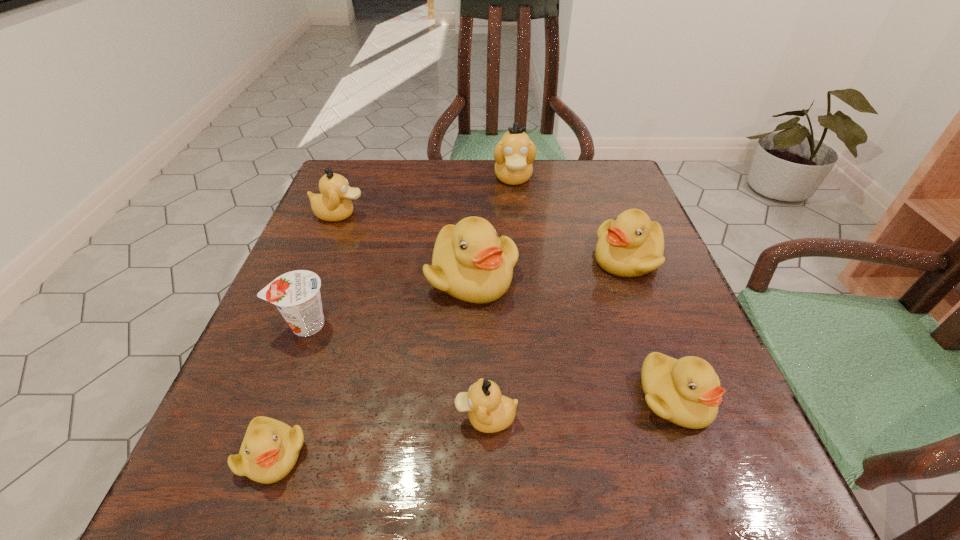
Locate an element on the screen. free location at the far left corner of the desktop is located at coordinates (368, 180).

The height and width of the screenshot is (540, 960). In the image, there is a desktop. Find the location of `vacant region at the near left corner`. vacant region at the near left corner is located at coordinates 214,476.

The height and width of the screenshot is (540, 960). I want to click on vacant space at the far right corner, so click(591, 191).

Find the location of `free space at the near right corner`. free space at the near right corner is located at coordinates (685, 489).

Find the location of a particular element. This screenshot has height=540, width=960. free space that is in between the nearest tan duckling and the third smallest yellow duckling is located at coordinates (557, 338).

At what (x,y) coordinates should I click in order to perform the action: click on vacant area that lies between the second biggest yellow duckling and the smallest tan duckling. Please return your answer as a coordinate pair (x, y). The image size is (960, 540). Looking at the image, I should click on (557, 338).

Locate an element on the screen. This screenshot has height=540, width=960. vacant region between the leftmost yellow duckling and the yogurt is located at coordinates (289, 389).

Find the location of a particular element. The image size is (960, 540). vacant space in between the third biggest yellow duckling and the leftmost tan duckling is located at coordinates (508, 306).

The height and width of the screenshot is (540, 960). What are the coordinates of `free space between the yogurt and the shortest object` in the screenshot? It's located at (289, 389).

This screenshot has height=540, width=960. In order to click on empty location between the biggest yellow duckling and the second nearest tan duckling in this screenshot , I will do `click(406, 246)`.